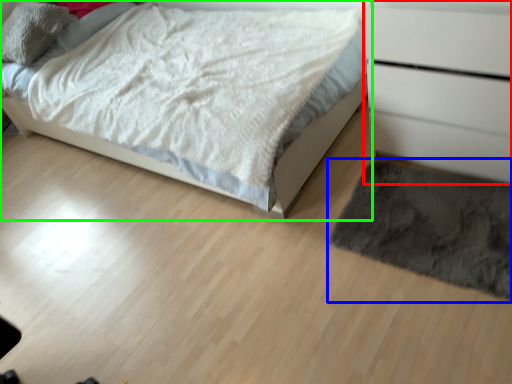
Question: Considering the real-world distances, which object is farthest from chest of drawers (highlighted by a red box)? mat (highlighted by a blue box) or bed (highlighted by a green box)?

Choices:
 (A) mat
 (B) bed

Answer: (B)